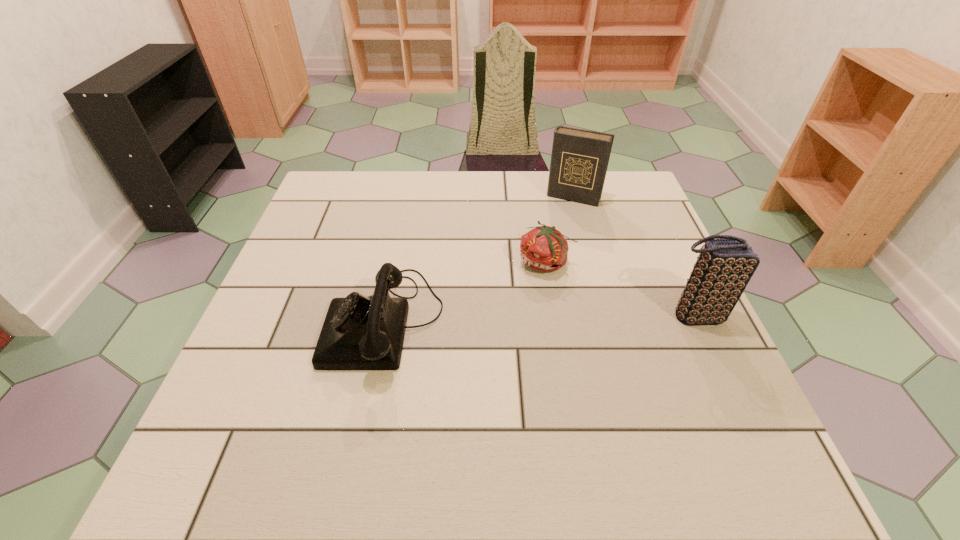
In order to click on free spot between the shortest object and the clutch bag in this screenshot , I will do `click(620, 289)`.

Find the location of a particular element. empty location between the tomato and the farthest object is located at coordinates (560, 230).

Find the location of a particular element. free point between the farthest object and the rightmost object is located at coordinates (635, 256).

The height and width of the screenshot is (540, 960). I want to click on free spot between the farthest object and the clutch bag, so click(x=635, y=256).

The image size is (960, 540). Identify the location of vacant space that is in between the diary and the leftmost object. [x=479, y=259].

Find the location of a particular element. Image resolution: width=960 pixels, height=540 pixels. free area in between the farthest object and the shortest object is located at coordinates point(560,230).

At what (x,y) coordinates should I click in order to perform the action: click on unoccupied position between the leftmost object and the rightmost object. Please return your answer as a coordinate pair (x, y). The image size is (960, 540). Looking at the image, I should click on (540, 318).

Where is `free space between the rightmost object and the shortest object`? This screenshot has width=960, height=540. free space between the rightmost object and the shortest object is located at coordinates (620, 289).

Locate an element on the screen. The height and width of the screenshot is (540, 960). object that is the second closest to the farthest object is located at coordinates (724, 267).

Locate an element on the screen. This screenshot has width=960, height=540. the second closest object to the tomato is located at coordinates (359, 333).